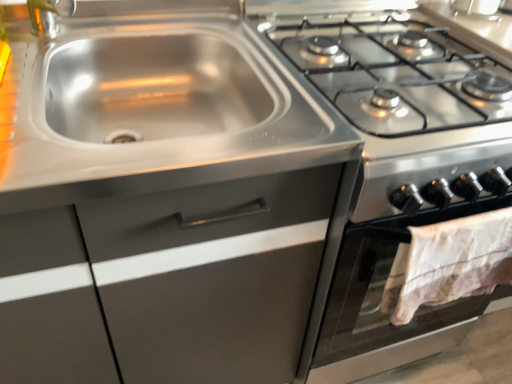
What do you see at coordinates (151, 102) in the screenshot? The height and width of the screenshot is (384, 512). I see `stainless steel sink at upper left` at bounding box center [151, 102].

The width and height of the screenshot is (512, 384). Describe the element at coordinates (397, 161) in the screenshot. I see `stainless steel stove at upper right` at that location.

Identify the location of white lace towel at lower right. The image size is (512, 384). (449, 263).

The image size is (512, 384). In order to click on stainless steel cabinet at upper left in this screenshot , I will do `click(174, 282)`.

In order to click on cabinetry below the white lace towel at lower right (from the image's perspective) in this screenshot , I will do `click(174, 282)`.

Which object is wider, white lace towel at lower right or stainless steel cabinet at upper left?

stainless steel cabinet at upper left.

Considering the sizes of objects white lace towel at lower right and stainless steel cabinet at upper left in the image provided, who is smaller, white lace towel at lower right or stainless steel cabinet at upper left?

Smaller between the two is white lace towel at lower right.

Is point (416, 275) closer or farther from the camera than point (111, 147)?

Point (416, 275) appears to be farther away from the viewer than point (111, 147).

Where is `blanket behind the stainless steel sink at upper left`? This screenshot has width=512, height=384. blanket behind the stainless steel sink at upper left is located at coordinates (449, 263).

Is white lace towel at lower right to the left or to the right of stainless steel sink at upper left in the image?

From the image, it's evident that white lace towel at lower right is to the right of stainless steel sink at upper left.

Based on their sizes in the image, would you say white lace towel at lower right is bigger or smaller than stainless steel sink at upper left?

In the image, white lace towel at lower right appears to be smaller than stainless steel sink at upper left.

Locate an element on the screen. The height and width of the screenshot is (384, 512). blanket behind the stainless steel cabinet at upper left is located at coordinates (449, 263).

From the image's perspective, relative to white lace towel at lower right, is stainless steel cabinet at upper left above or below?

stainless steel cabinet at upper left is situated lower than white lace towel at lower right in the image.

What's the angular difference between stainless steel cabinet at upper left and white lace towel at lower right's facing directions?

stainless steel cabinet at upper left and white lace towel at lower right are facing 1.09 degrees away from each other.

Is stainless steel cabinet at upper left completely or partially outside of white lace towel at lower right?

That's correct, stainless steel cabinet at upper left is outside of white lace towel at lower right.

Is stainless steel stove at upper right taller or shorter than stainless steel cabinet at upper left?

Clearly, stainless steel stove at upper right is shorter compared to stainless steel cabinet at upper left.

Is stainless steel stove at upper right next to stainless steel cabinet at upper left?

stainless steel stove at upper right and stainless steel cabinet at upper left are clearly separated.

From the image's perspective, which one is positioned lower, stainless steel stove at upper right or stainless steel cabinet at upper left?

stainless steel cabinet at upper left is shown below in the image.

At what (x,y) coordinates should I click in order to perform the action: click on cabinetry in front of the stainless steel stove at upper right. Please return your answer as a coordinate pair (x, y). This screenshot has width=512, height=384. Looking at the image, I should click on (174, 282).

Consider the image. What's the angular difference between stainless steel sink at upper left and stainless steel stove at upper right's facing directions?

1.09 degrees separate the facing orientations of stainless steel sink at upper left and stainless steel stove at upper right.

Between stainless steel sink at upper left and stainless steel stove at upper right, which one is positioned behind?

stainless steel stove at upper right is behind.

Is stainless steel sink at upper left bigger or smaller than stainless steel stove at upper right?

In the image, stainless steel sink at upper left appears to be smaller than stainless steel stove at upper right.

Is stainless steel sink at upper left turned away from stainless steel stove at upper right?

No.

From a real-world perspective, is white lace towel at lower right beneath stainless steel stove at upper right?

Actually, white lace towel at lower right is physically above stainless steel stove at upper right in the real world.

Who is shorter, white lace towel at lower right or stainless steel stove at upper right?

white lace towel at lower right is shorter.

Would you consider white lace towel at lower right to be distant from stainless steel stove at upper right?

They are positioned close to each other.

Between stainless steel sink at upper left and stainless steel cabinet at upper left, which one has less height?

stainless steel sink at upper left.

Is stainless steel sink at upper left wider or thinner than stainless steel cabinet at upper left?

Clearly, stainless steel sink at upper left has less width compared to stainless steel cabinet at upper left.

Can stainless steel cabinet at upper left be found inside stainless steel sink at upper left?

That's incorrect, stainless steel cabinet at upper left is not inside stainless steel sink at upper left.

The width and height of the screenshot is (512, 384). I want to click on cabinetry that appears below the stainless steel sink at upper left (from a real-world perspective), so click(174, 282).

This screenshot has width=512, height=384. Find the location of `cabinetry in front of the white lace towel at lower right`. cabinetry in front of the white lace towel at lower right is located at coordinates (174, 282).

Find the location of a particular element. blanket that is under the stainless steel sink at upper left (from a real-world perspective) is located at coordinates (449, 263).

Estimate the real-world distances between objects in this image. Which object is closer to stainless steel sink at upper left, white lace towel at lower right or stainless steel cabinet at upper left?

stainless steel cabinet at upper left lies closer to stainless steel sink at upper left than the other object.

Estimate the real-world distances between objects in this image. Which object is closer to white lace towel at lower right, stainless steel stove at upper right or stainless steel sink at upper left?

stainless steel stove at upper right lies closer to white lace towel at lower right than the other object.

From the image, which object appears to be nearer to white lace towel at lower right, stainless steel stove at upper right or stainless steel cabinet at upper left?

Among the two, stainless steel stove at upper right is located nearer to white lace towel at lower right.

Which object lies nearer to the anchor point stainless steel cabinet at upper left, stainless steel stove at upper right or stainless steel sink at upper left?

stainless steel sink at upper left is positioned closer to the anchor stainless steel cabinet at upper left.

Considering their positions, is white lace towel at lower right positioned closer to stainless steel cabinet at upper left than stainless steel sink at upper left?

The object closer to stainless steel cabinet at upper left is stainless steel sink at upper left.

When comparing their distances from stainless steel sink at upper left, does stainless steel stove at upper right or white lace towel at lower right seem further?

The object further to stainless steel sink at upper left is white lace towel at lower right.

Looking at this image, looking at the image, which one is located closer to stainless steel cabinet at upper left, stainless steel sink at upper left or stainless steel stove at upper right?

Based on the image, stainless steel sink at upper left appears to be nearer to stainless steel cabinet at upper left.

In the scene shown: Considering their positions, is stainless steel sink at upper left positioned closer to stainless steel cabinet at upper left than white lace towel at lower right?

Based on the image, stainless steel sink at upper left appears to be nearer to stainless steel cabinet at upper left.

You are a GUI agent. You are given a task and a screenshot of the screen. Output one action in this format:
    pyautogui.click(x=<x>, y=<y>)
    Task: Click on the appliance between stainless steel cabinet at upper left and white lace towel at lower right
    This screenshot has width=512, height=384.
    Given the screenshot: What is the action you would take?
    pyautogui.click(x=397, y=161)

In order to click on sink between stainless steel cabinet at upper left and stainless steel stove at upper right from left to right in this screenshot , I will do `click(151, 102)`.

Locate an element on the screen. appliance between stainless steel sink at upper left and white lace towel at lower right is located at coordinates (397, 161).

In order to click on sink situated between stainless steel cabinet at upper left and white lace towel at lower right from left to right in this screenshot , I will do `click(151, 102)`.